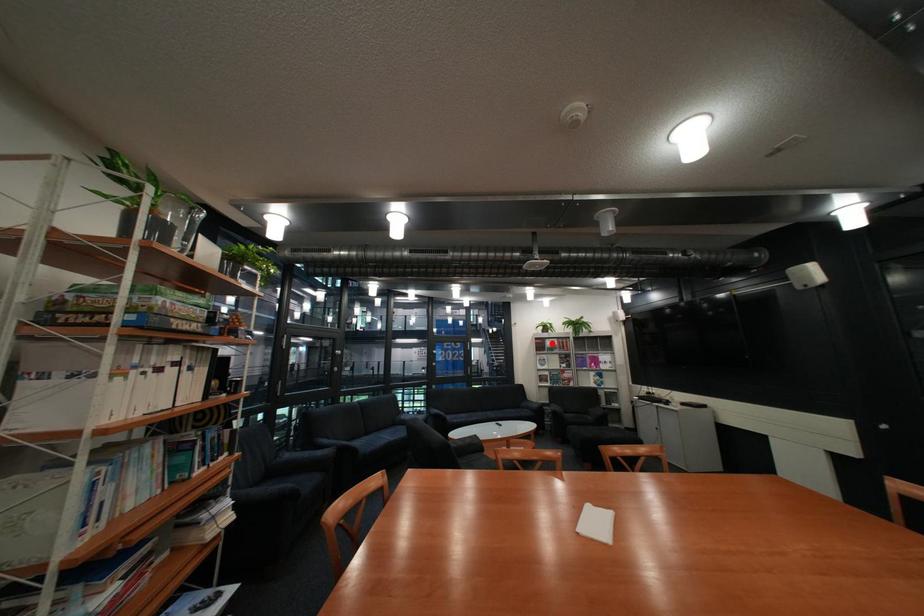
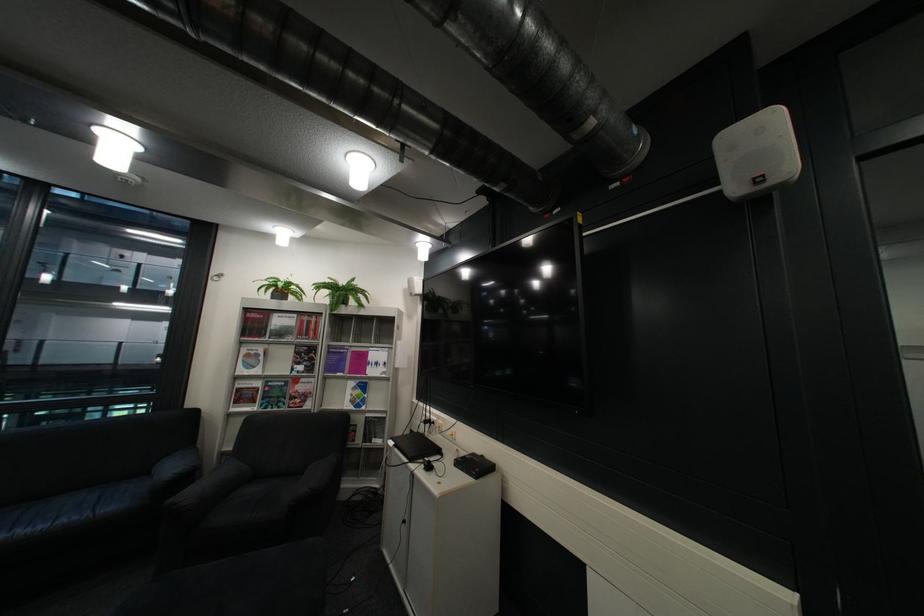
Where in the second image is the point corresponding to the highlighted location from the first image?

(260, 320)